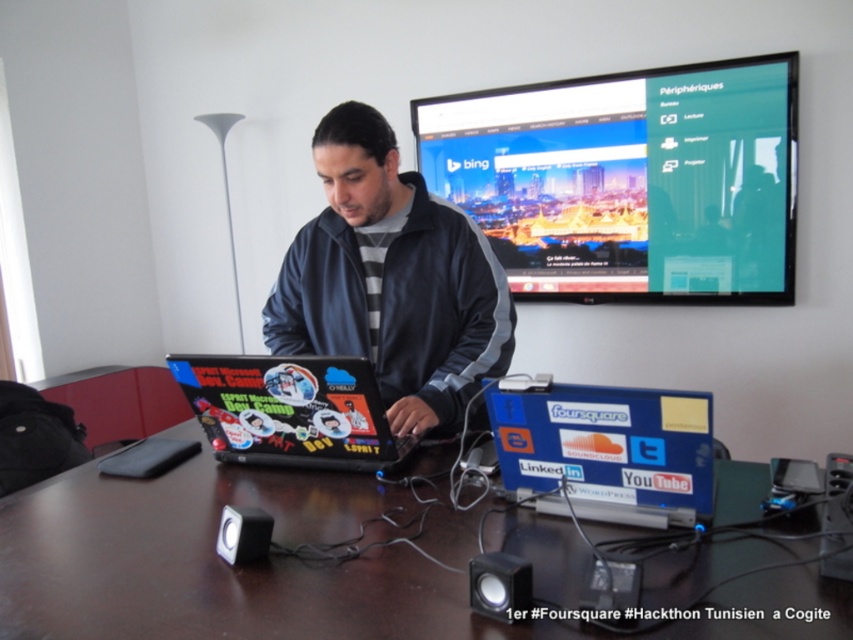
Who is lower down, brown wooden table at center or sticker-covered laptop at center?

brown wooden table at center is lower down.

Locate an element on the screen. This screenshot has height=640, width=853. brown wooden table at center is located at coordinates (221, 563).

I want to click on brown wooden table at center, so click(221, 563).

Between matte black laptop at center and sticker-covered laptop at center, which one has less height?

sticker-covered laptop at center

Does matte black laptop at center have a lesser height compared to sticker-covered laptop at center?

In fact, matte black laptop at center may be taller than sticker-covered laptop at center.

Does point (318, 348) come behind point (265, 371)?

Yes.

The height and width of the screenshot is (640, 853). I want to click on matte black laptop at center, so click(x=392, y=280).

Between brown wooden table at center and blue plastic laptop at center, which one has less height?

brown wooden table at center is shorter.

Who is more forward, (331, 536) or (519, 388)?

Positioned in front is point (519, 388).

Where is `brown wooden table at center`? brown wooden table at center is located at coordinates (221, 563).

Locate an element on the screen. brown wooden table at center is located at coordinates (221, 563).